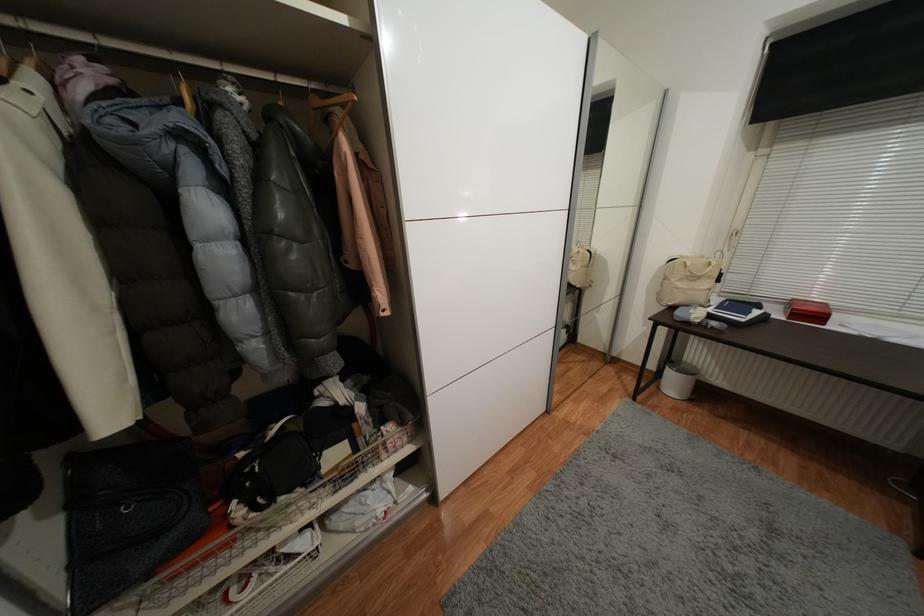
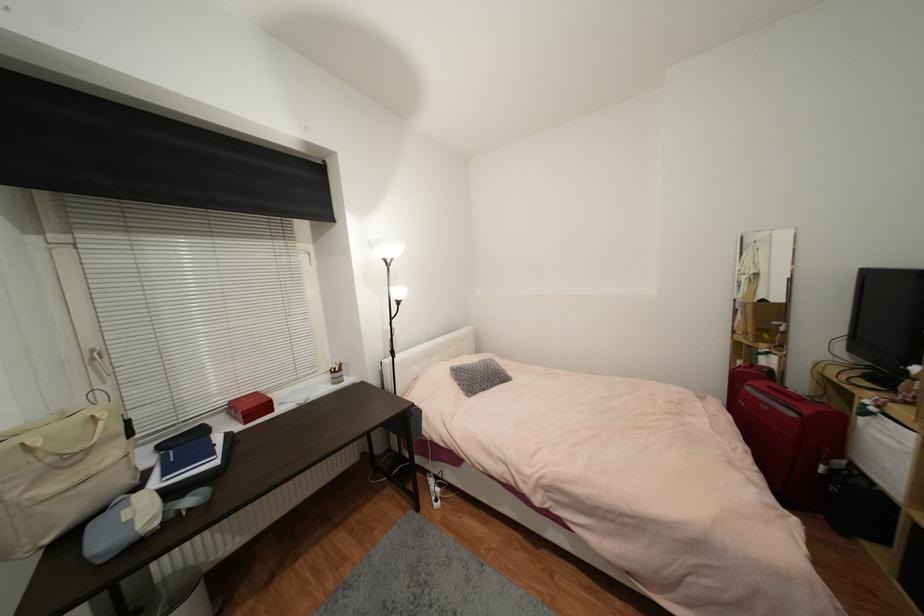
Question: The camera is either moving clockwise (left) or counter-clockwise (right) around the object. The first image is from the beginning of the video and the second image is from the end. Is the camera moving left or right when shooting the video?

Choices:
 (A) Left
 (B) Right

Answer: (A)